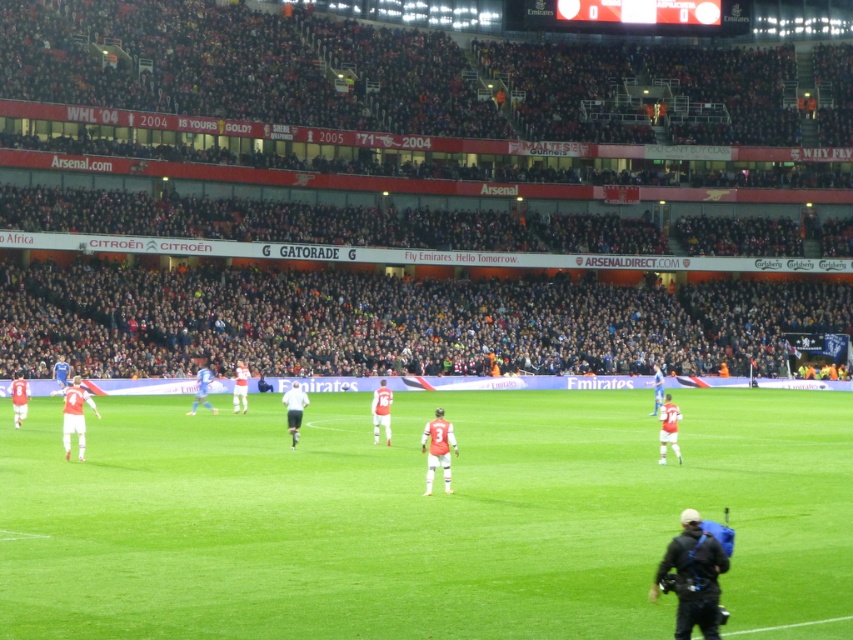
Is black fabric camera at lower right taller than blue jersey at center?

No, black fabric camera at lower right is not taller than blue jersey at center.

Is point (674, 563) farther from camera compared to point (202, 385)?

That is False.

Who is more forward, (712, 602) or (204, 403)?

Positioned in front is point (712, 602).

Locate an element on the screen. black fabric camera at lower right is located at coordinates (693, 577).

Does green grass field at center appear on the left side of white matte shirt at center?

Incorrect, green grass field at center is not on the left side of white matte shirt at center.

Where is `green grass field at center`? green grass field at center is located at coordinates (421, 516).

Identify the location of green grass field at center. This screenshot has width=853, height=640. (421, 516).

Is black fabric camera at lower right wider than white matte shirt at center?

Incorrect, black fabric camera at lower right's width does not surpass white matte shirt at center's.

Can you confirm if black fabric camera at lower right is thinner than white matte shirt at center?

Yes, black fabric camera at lower right is thinner than white matte shirt at center.

Which is in front, point (717, 588) or point (281, 397)?

Point (717, 588) is in front.

This screenshot has height=640, width=853. In order to click on black fabric camera at lower right in this screenshot , I will do `click(693, 577)`.